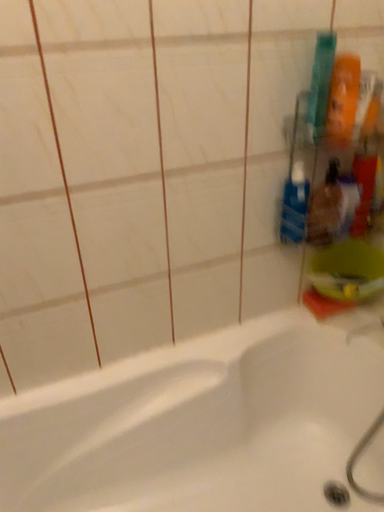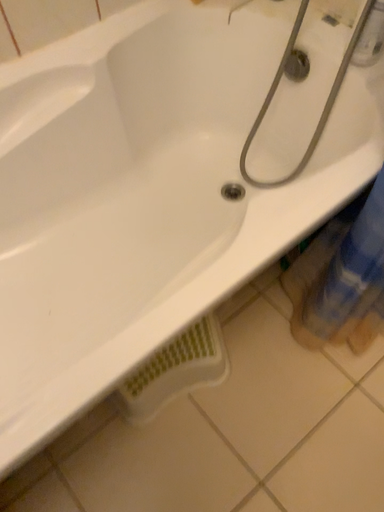
Question: Which way did the camera rotate in the video?

Choices:
 (A) rotated right
 (B) rotated left

Answer: (A)